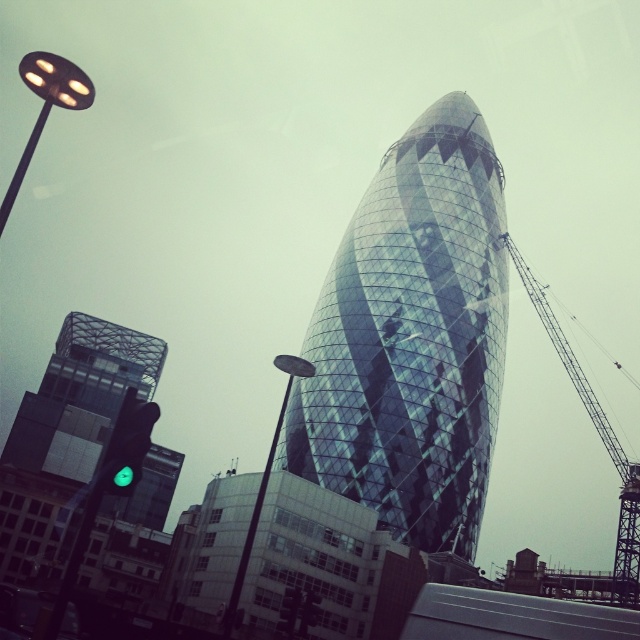
You are a city planner assessing the urban layout. You need to determine which of the two glassy structures, the glassy reflective tower at center or the glassy modern building at left, is positioned higher in the scene. Based on the provided information, which one is higher?

The glassy reflective tower at center is higher than the glassy modern building at left because it is located above it in the scene.

You are a city planner assessing the space between the glassy reflective tower at center and the metallic gray crane at right. If the crane needs to move sideways to access a construction site, would the space between them allow it?

The glassy reflective tower at center might be wider than metallic gray crane at right, so there may not be enough space for the crane to move sideways safely. Further measurements are needed to confirm.

You are a city planner analyzing the urban layout. You need to determine the visibility of the glassy reflective tower at center from the location of the metallic gray crane at right. Based on their positions, can the crane operator see the tower clearly?

The glassy reflective tower at center is closer to the viewer than the metallic gray crane at right, so the crane operator would have an unobstructed view of the tower since it is positioned in front of the crane.